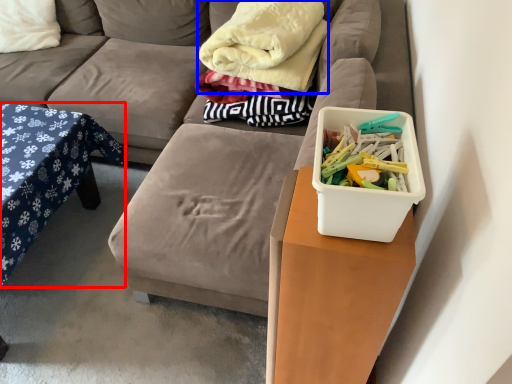
Question: Which point is further to the camera, table (highlighted by a red box) or blanket (highlighted by a blue box)?

Choices:
 (A) table
 (B) blanket

Answer: (B)